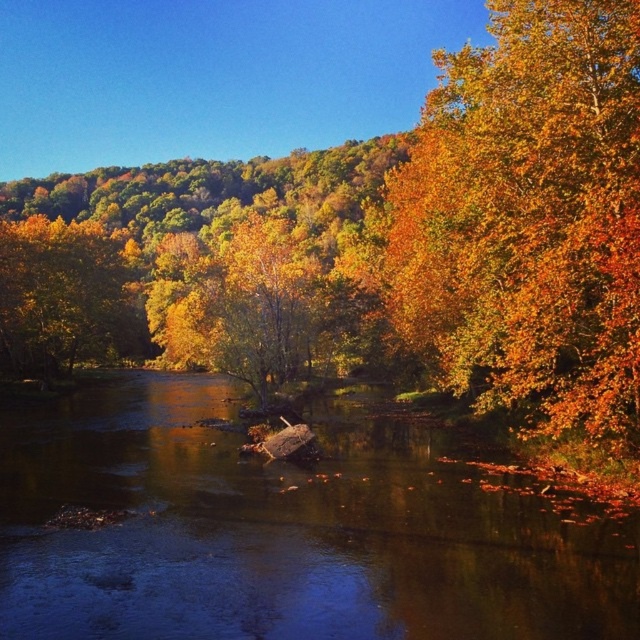
Is point (387, 588) farther from camera compared to point (132, 289)?

No, it is not.

Does point (224, 525) come in front of point (61, 243)?

Yes, it is.

Describe the element at coordinates (284, 532) in the screenshot. I see `shiny brown water at center` at that location.

Where is `shiny brown water at center`? The height and width of the screenshot is (640, 640). shiny brown water at center is located at coordinates (284, 532).

Who is more forward, [404,186] or [76,358]?

Point [404,186] is in front.

Between golden leafy tree at right and golden leafy tree at left, which one is positioned lower?

Positioned lower is golden leafy tree at left.

Which is behind, point (428, 211) or point (72, 264)?

Positioned behind is point (72, 264).

Where is `golden leafy tree at right`? The width and height of the screenshot is (640, 640). golden leafy tree at right is located at coordinates (529, 220).

Does shiny brown water at center have a greater width compared to golden leafy tree at right?

Correct, the width of shiny brown water at center exceeds that of golden leafy tree at right.

Can you confirm if shiny brown water at center is taller than golden leafy tree at right?

No, shiny brown water at center is not taller than golden leafy tree at right.

Does point (310, 548) come behind point (486, 104)?

No.

Locate an element on the screen. Image resolution: width=640 pixels, height=640 pixels. shiny brown water at center is located at coordinates (284, 532).